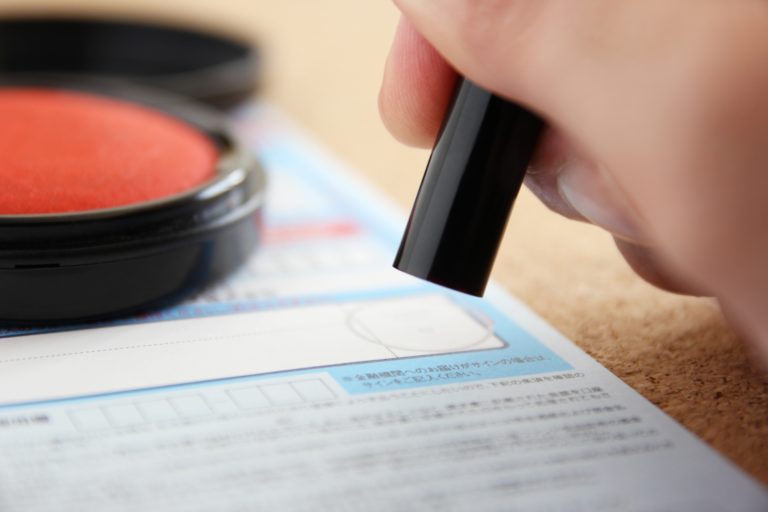
Find the location of a particular element. The width and height of the screenshot is (768, 512). wall beige is located at coordinates (319, 41).